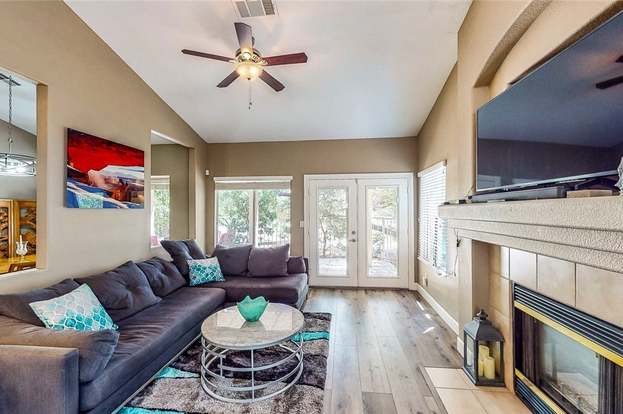
Find the location of a particular element. celling fan is located at coordinates (265, 64).